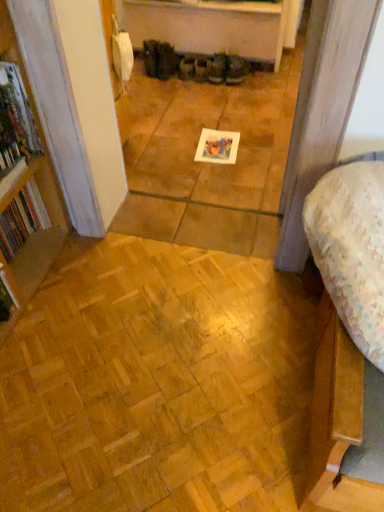
You are a GUI agent. You are given a task and a screenshot of the screen. Output one action in this format:
    pyautogui.click(x=<x>, y=<y>)
    Task: Click on the vacant area located to the right-hand side of matte brown boot at center
    The image size is (384, 512).
    Given the screenshot: What is the action you would take?
    pyautogui.click(x=270, y=79)